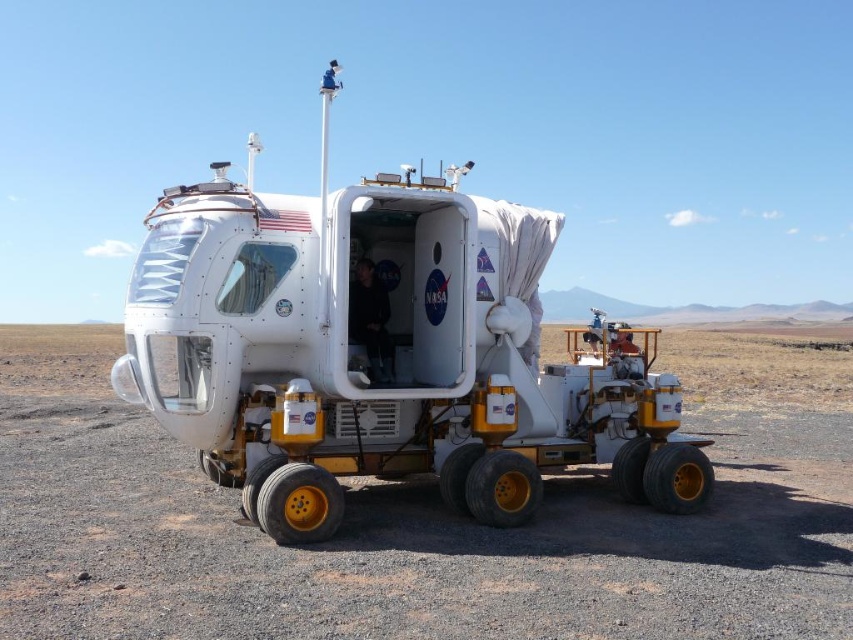
Does dirt gravel at center appear on the right side of white matte rover at center?

Correct, you'll find dirt gravel at center to the right of white matte rover at center.

Can you confirm if dirt gravel at center is positioned below white matte rover at center?

Correct, dirt gravel at center is located below white matte rover at center.

Describe the element at coordinates (424, 522) in the screenshot. I see `dirt gravel at center` at that location.

At what (x,y) coordinates should I click in order to perform the action: click on dirt gravel at center. Please return your answer as a coordinate pair (x, y). Looking at the image, I should click on (424, 522).